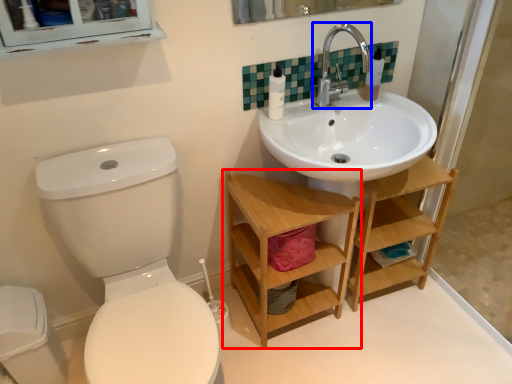
Question: Which of the following is the closest to the observer, shelf (highlighted by a red box) or tap (highlighted by a blue box)?

Choices:
 (A) shelf
 (B) tap

Answer: (A)